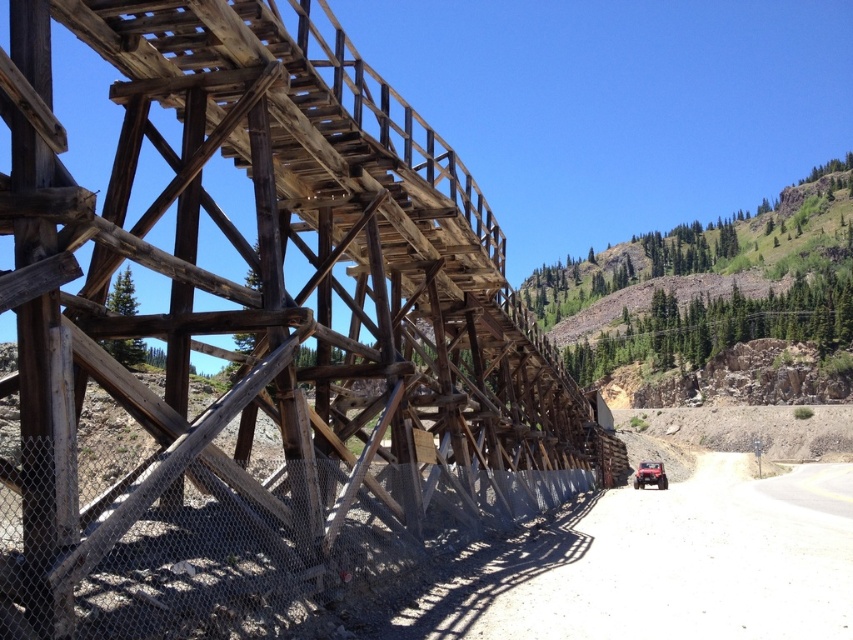
You are a delivery driver needing to cross the weathered wood train bridge at center with your rubberized matte red car at lower right. The bridge has a weight limit of 50 tons. Your car weighs 2 tons. Can you safely cross the bridge with your car?

The bridge has a weight limit of 50 tons, and your car weighs only 2 tons. Since 2 tons is well below the 50 ton limit, you can safely cross the weathered wood train bridge at center with your rubberized matte red car at lower right.

You are standing at the point marked as point (256, 333). What object are you directly facing?

You are directly facing the weathered wood train bridge at center located at point (256, 333).